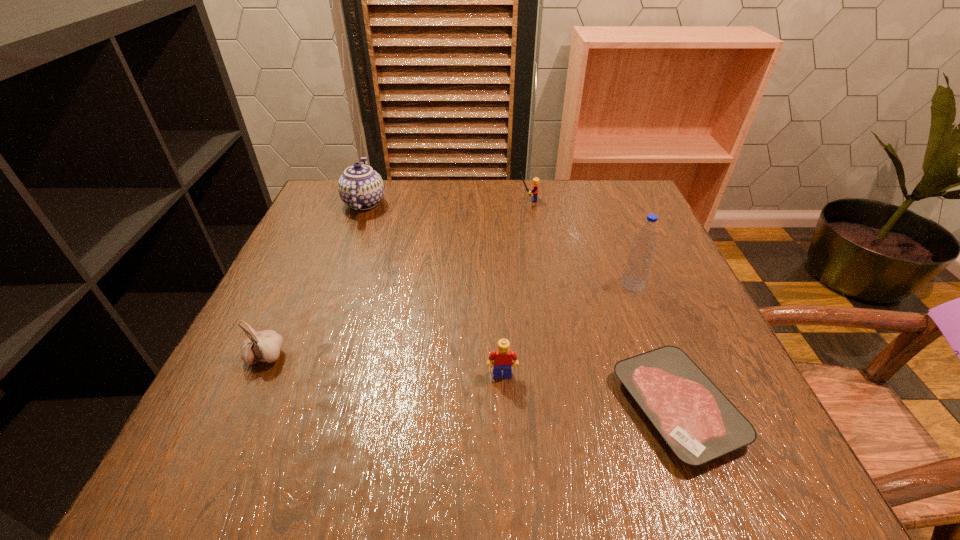
Identify the location of vacant space at the far left corner. The height and width of the screenshot is (540, 960). (338, 198).

In the image, there is a desktop. Identify the location of vacant area at the far right corner. (601, 183).

The image size is (960, 540). In the image, there is a desktop. What are the coordinates of `vacant space at the near right corner` in the screenshot? It's located at (697, 476).

Image resolution: width=960 pixels, height=540 pixels. Find the location of `vacant area that lies between the tallest object and the fifth shortest object`. vacant area that lies between the tallest object and the fifth shortest object is located at coordinates (498, 244).

What are the coordinates of `vacant space that is in between the steak and the third farthest object` in the screenshot? It's located at click(x=655, y=346).

This screenshot has width=960, height=540. In order to click on empty location between the garlic and the third object from right to left in this screenshot , I will do `click(397, 278)`.

Identify the location of free space between the tallest object and the shortest object. The image size is (960, 540). 655,346.

Image resolution: width=960 pixels, height=540 pixels. Find the location of `free spot between the third object from left to right and the chinaware`. free spot between the third object from left to right and the chinaware is located at coordinates (433, 289).

You are a GUI agent. You are given a task and a screenshot of the screen. Output one action in this format:
    pyautogui.click(x=<x>, y=<y>)
    Task: Click on the free spot between the fourth object from right to left and the chinaware
    
    Given the screenshot: What is the action you would take?
    pyautogui.click(x=433, y=289)

Identify the location of free space between the shortest object and the tallest object. (655, 346).